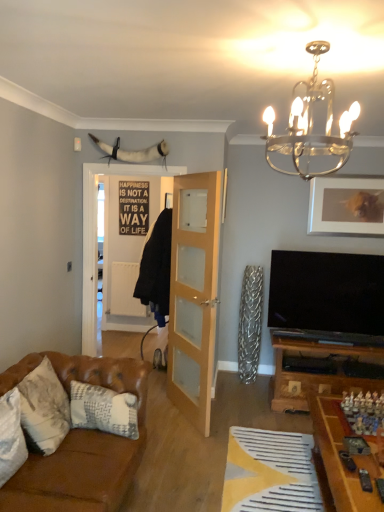
Question: Is matte silver picture frame at upper right not near white textured pillow at lower left, the 3th pillow when ordered from back to front?

Choices:
 (A) yes
 (B) no

Answer: (A)

Question: Is matte silver picture frame at upper right bigger than white textured pillow at lower left, which appears as the 1th pillow when viewed from the front?

Choices:
 (A) yes
 (B) no

Answer: (B)

Question: Is matte silver picture frame at upper right positioned with its back to white textured pillow at lower left, the 3th pillow when ordered from back to front?

Choices:
 (A) no
 (B) yes

Answer: (A)

Question: Considering the relative sizes of matte silver picture frame at upper right and white textured pillow at lower left, which appears as the 1th pillow when viewed from the front, in the image provided, is matte silver picture frame at upper right shorter than white textured pillow at lower left, which appears as the 1th pillow when viewed from the front,?

Choices:
 (A) no
 (B) yes

Answer: (A)

Question: Is matte silver picture frame at upper right closer to camera compared to white textured pillow at lower left, which appears as the 1th pillow when viewed from the front?

Choices:
 (A) yes
 (B) no

Answer: (B)

Question: Considering the relative sizes of matte silver picture frame at upper right and white textured pillow at lower left, which appears as the 1th pillow when viewed from the front, in the image provided, is matte silver picture frame at upper right taller than white textured pillow at lower left, which appears as the 1th pillow when viewed from the front,?

Choices:
 (A) yes
 (B) no

Answer: (A)

Question: From a real-world perspective, is matte silver picture frame at upper right on white textured pillow at lower left, positioned as the 3th pillow in front-to-back order?

Choices:
 (A) yes
 (B) no

Answer: (A)

Question: Is matte silver picture frame at upper right smaller than white textured pillow at lower left, acting as the 1th pillow starting from the back?

Choices:
 (A) no
 (B) yes

Answer: (B)

Question: Does matte silver picture frame at upper right have a lesser width compared to white textured pillow at lower left, acting as the 1th pillow starting from the back?

Choices:
 (A) no
 (B) yes

Answer: (B)

Question: Is matte silver picture frame at upper right taller than white textured pillow at lower left, acting as the 1th pillow starting from the back?

Choices:
 (A) no
 (B) yes

Answer: (B)

Question: Is matte silver picture frame at upper right to the left of white textured pillow at lower left, acting as the 1th pillow starting from the back, from the viewer's perspective?

Choices:
 (A) no
 (B) yes

Answer: (A)

Question: Is there a large distance between matte silver picture frame at upper right and white textured pillow at lower left, acting as the 1th pillow starting from the back?

Choices:
 (A) yes
 (B) no

Answer: (A)

Question: Is white textured pillow at lower left, the 3th pillow when ordered from back to front, aimed at clear glass door at center?

Choices:
 (A) no
 (B) yes

Answer: (A)